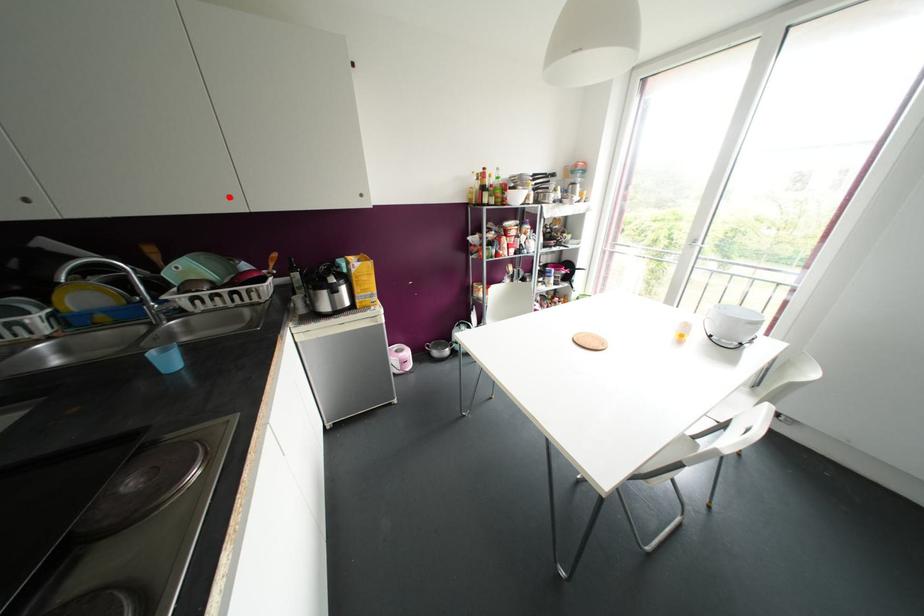
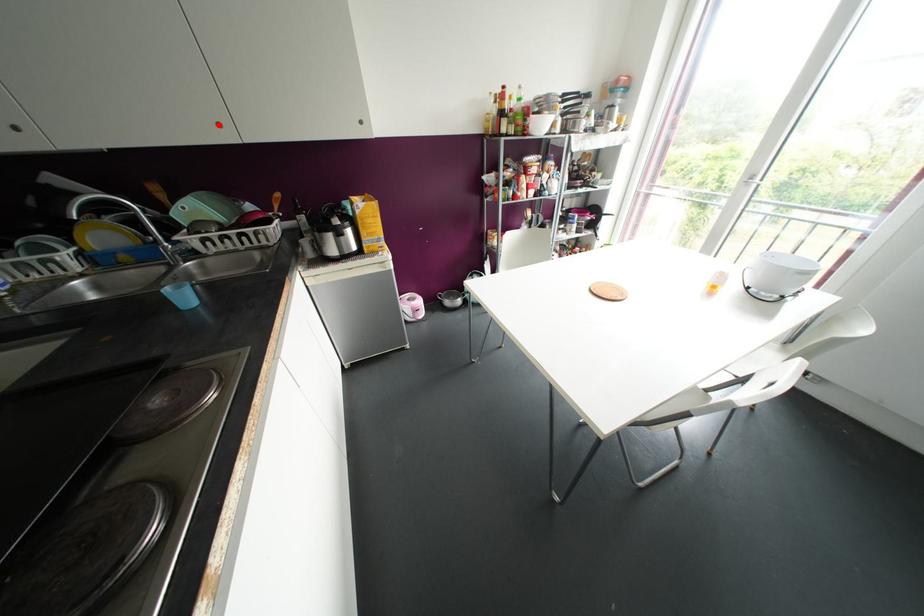
I am providing you with two images of the same scene from different viewpoints. A red point is marked on the first image and another point is marked on the second image. Does the point marked in image1 correspond to the same location as the one in image2?

Yes